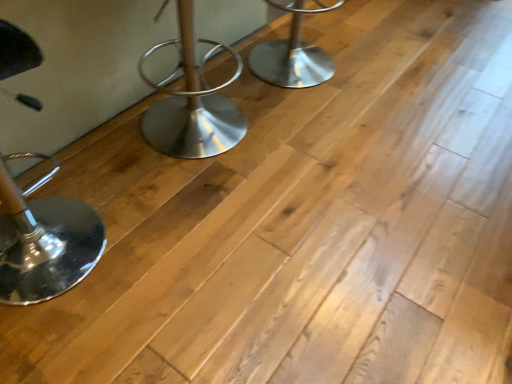
At what (x,y) coordinates should I click in order to perform the action: click on free space behind polished chrome stool at left, the second furniture positioned from the top. Please return your answer as a coordinate pair (x, y). The width and height of the screenshot is (512, 384). Looking at the image, I should click on (92, 164).